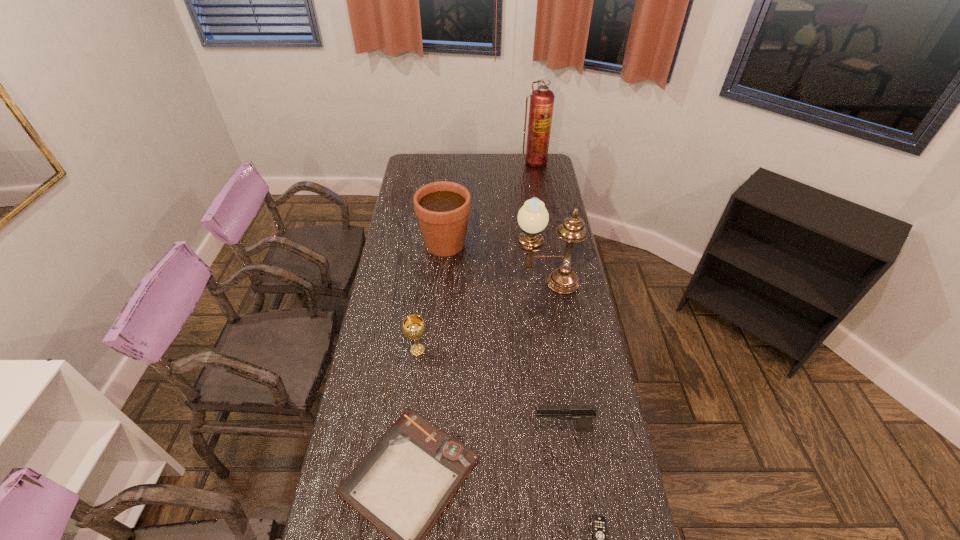
This screenshot has height=540, width=960. Identify the location of the farthest object. (542, 99).

This screenshot has width=960, height=540. Find the location of `the fifth nearest object`. the fifth nearest object is located at coordinates (533, 217).

I want to click on flowerpot, so click(442, 208).

What are the coordinates of `the fifth shortest object` in the screenshot? It's located at (442, 208).

This screenshot has width=960, height=540. I want to click on the fourth nearest object, so click(x=414, y=327).

The width and height of the screenshot is (960, 540). Find the location of `the fourth tallest object`. the fourth tallest object is located at coordinates coord(414,327).

The width and height of the screenshot is (960, 540). What are the coordinates of `pistol` in the screenshot? It's located at (583, 414).

This screenshot has height=540, width=960. I want to click on vacant area located on the side of the farthest object with the label, so click(538, 182).

Locate an element on the screen. Image resolution: width=960 pixels, height=540 pixels. vacant space situated on the back of the fifth nearest object is located at coordinates (538, 225).

This screenshot has width=960, height=540. In order to click on blank space located on the back of the flowerpot in this screenshot , I will do `click(450, 185)`.